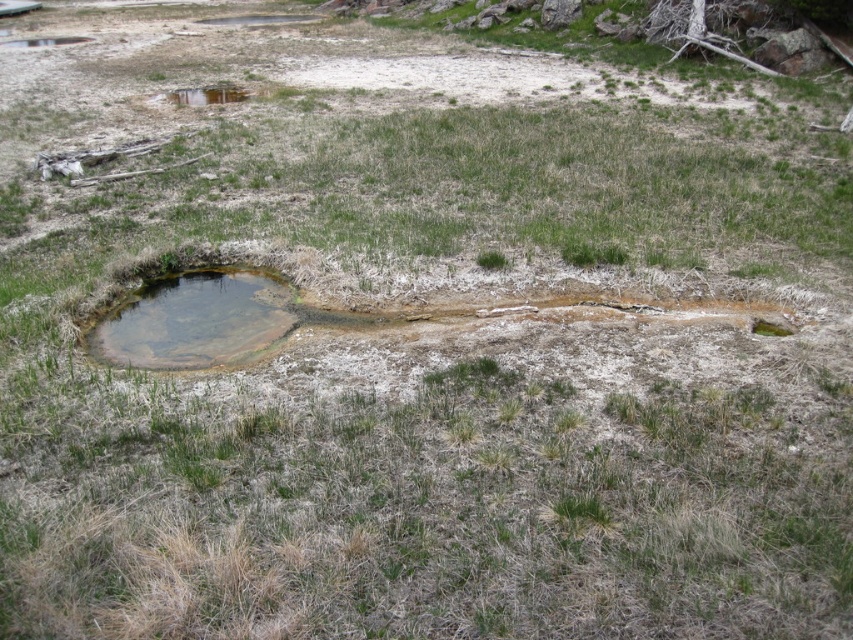
Which is more to the left, brown sedimentary pool at center or brown sedimentary rock at lower right?

Positioned to the left is brown sedimentary pool at center.

Is point (149, 364) in front of point (758, 324)?

Yes, it is.

Find the location of `brown sedimentary pool at center`. brown sedimentary pool at center is located at coordinates (194, 321).